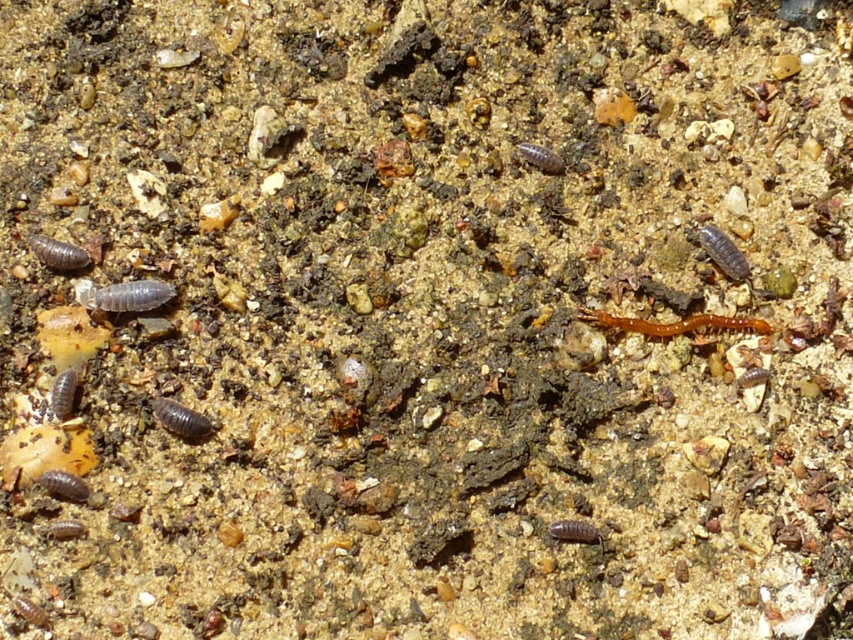
You are a researcher studying soil organisms. You observe the smooth brown worm at lower left in the image. What are its exact coordinates in the 2D plane?

The smooth brown worm at lower left is located at coordinates 0.616 on the x axis and 0.075 on the y axis.

Consider the image. You are a gardener examining the soil. You notice the orange matte centipede at center and the brown matte worm at center. Which one is positioned higher up in the scene?

The orange matte centipede at center is above the brown matte worm at center, so it is positioned higher up in the scene.